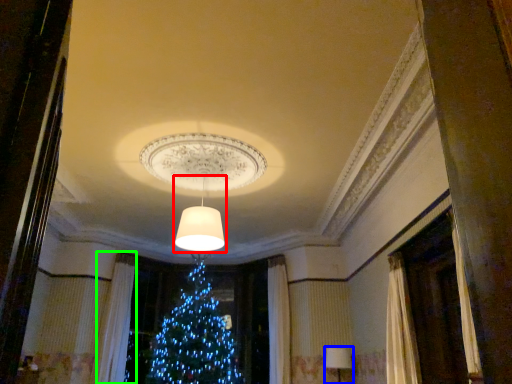
Question: Considering the real-world distances, which object is farthest from lamp (highlighted by a red box)? lamp (highlighted by a blue box) or curtain (highlighted by a green box)?

Choices:
 (A) lamp
 (B) curtain

Answer: (B)